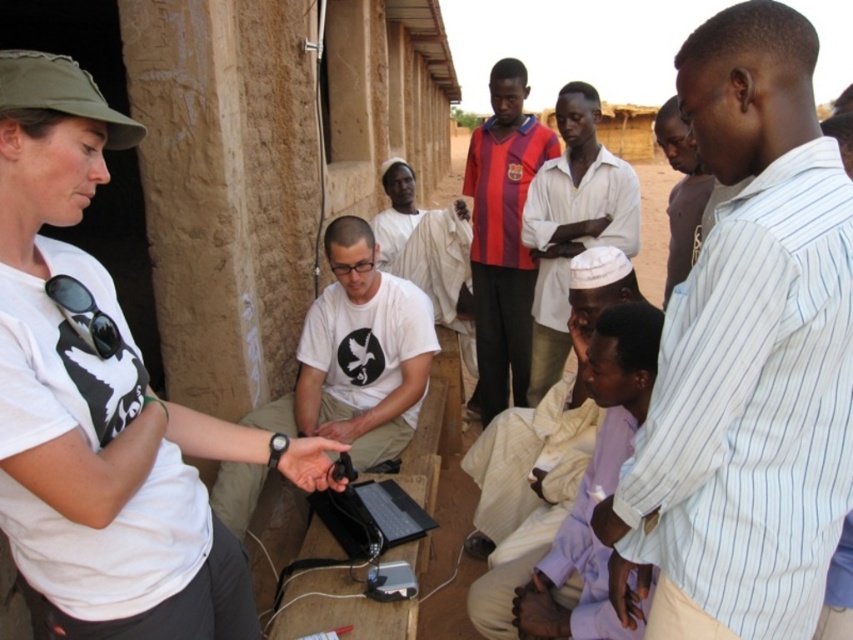
Question: Can you confirm if white matte t-shirt at left is thinner than black plastic laptop at center?

Choices:
 (A) no
 (B) yes

Answer: (A)

Question: Which object is closer to the camera taking this photo?

Choices:
 (A) white cotton shirt at center
 (B) matte white shirt at upper right

Answer: (B)

Question: Is purple cotton shirt at lower center to the left of matte white shirt at upper right from the viewer's perspective?

Choices:
 (A) no
 (B) yes

Answer: (B)

Question: Based on their relative distances, which object is farther from the black plastic laptop at center?

Choices:
 (A) purple cotton shirt at lower center
 (B) striped fabric shirt at center
 (C) white striped shirt at center
 (D) white cotton shirt at center

Answer: (B)

Question: Where is white matte t-shirt at left located in relation to black plastic laptop at center in the image?

Choices:
 (A) above
 (B) below

Answer: (A)

Question: Which of the following is the closest to the observer?

Choices:
 (A) (343, 403)
 (B) (410, 522)
 (C) (514, 164)
 (D) (589, 312)

Answer: (B)